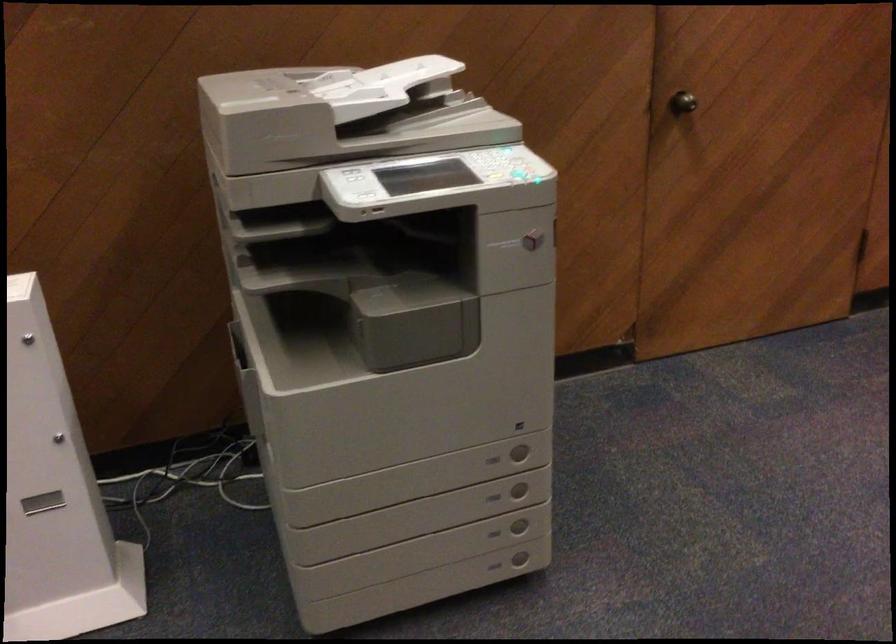
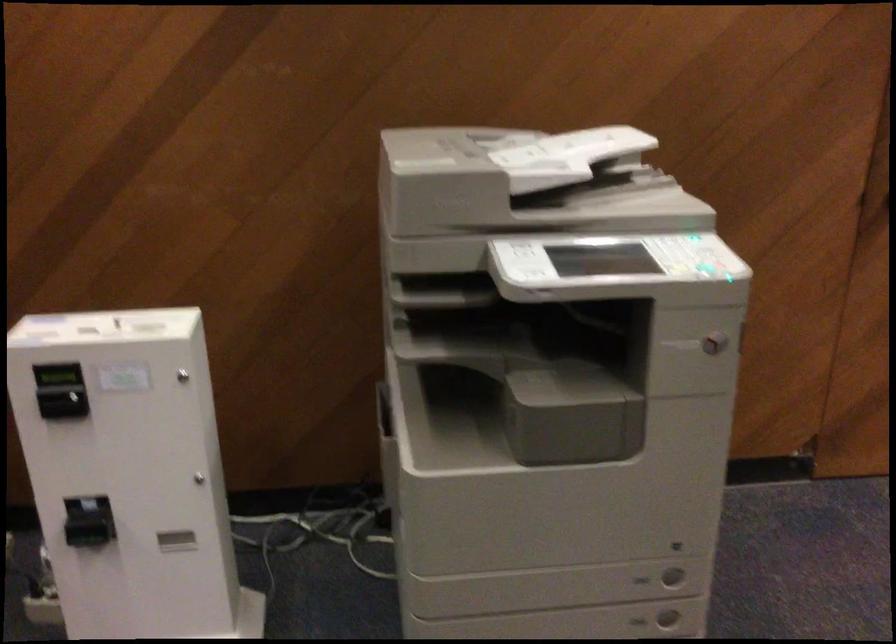
Where in the second image is the point corresponding to [500,462] from the first image?

(642, 580)